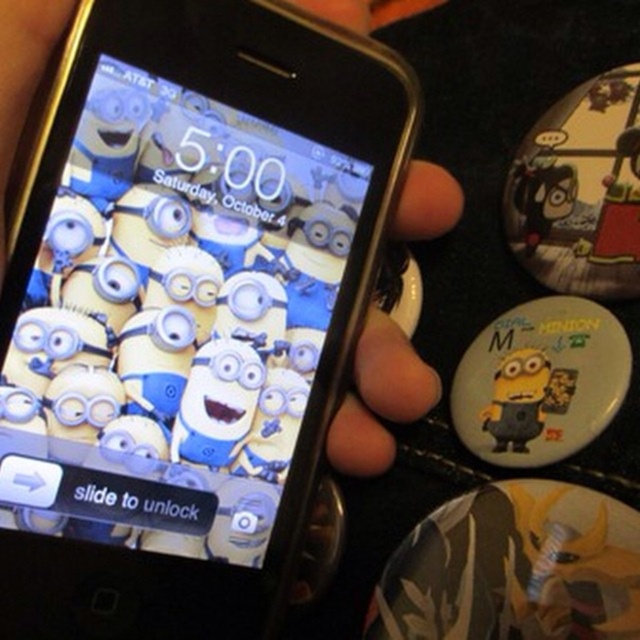
Based on the photo, between black plastic smartphone at center and white matte badge at lower right, which one is positioned lower?

Positioned lower is white matte badge at lower right.

Is black plastic smartphone at center positioned before white matte badge at lower right?

Yes, black plastic smartphone at center is closer to the viewer.

The width and height of the screenshot is (640, 640). What do you see at coordinates (189, 304) in the screenshot?
I see `black plastic smartphone at center` at bounding box center [189, 304].

The height and width of the screenshot is (640, 640). What are the coordinates of `black plastic smartphone at center` in the screenshot? It's located at (189, 304).